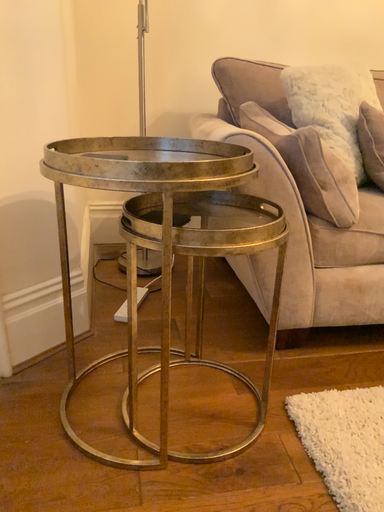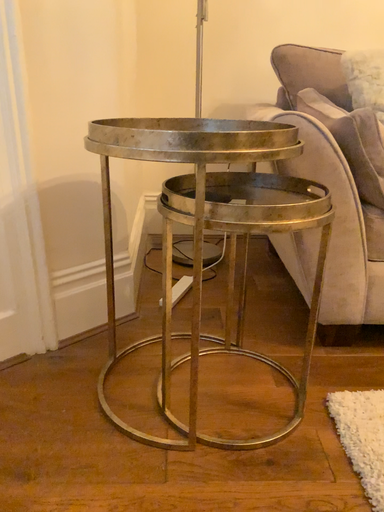
Question: How did the camera likely rotate when shooting the video?

Choices:
 (A) rotated left
 (B) rotated right

Answer: (A)